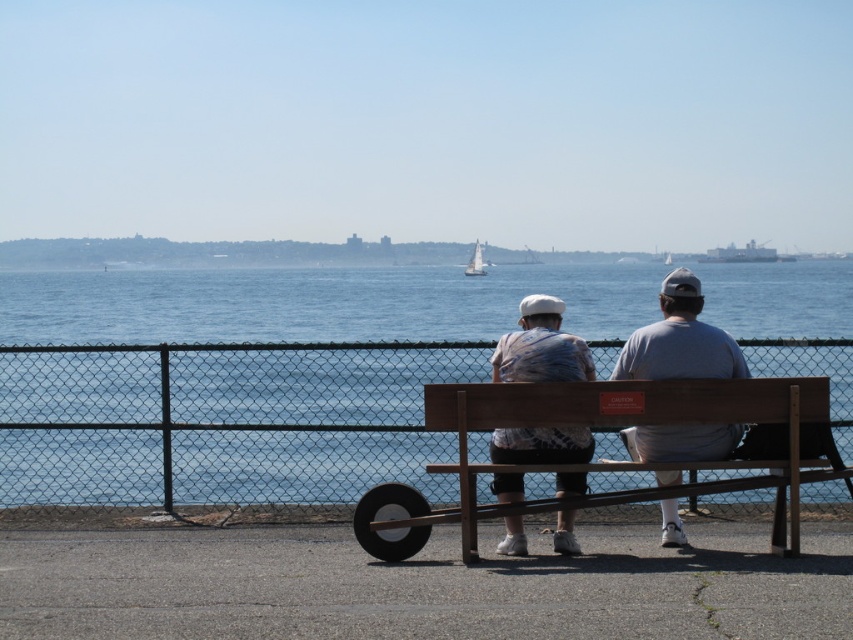
Question: Which object is farther from the camera taking this photo?

Choices:
 (A) white sailboat at center
 (B) metallic gray ship at upper right
 (C) wooden bench at center
 (D) white matte shirt at center

Answer: (B)

Question: Which object is farther from the camera taking this photo?

Choices:
 (A) wooden bench at center
 (B) metal chain-link fence at center
 (C) metallic gray ship at upper right

Answer: (C)

Question: Can you confirm if white cotton shirt at center is positioned to the right of white matte shirt at center?

Choices:
 (A) no
 (B) yes

Answer: (B)

Question: Can you confirm if wooden bench at center is positioned below white sailboat at center?

Choices:
 (A) yes
 (B) no

Answer: (A)

Question: Which object is positioned farthest from the white sailboat at center?

Choices:
 (A) white cotton shirt at center
 (B) metallic gray ship at upper right
 (C) wooden bench at center
 (D) white matte shirt at center

Answer: (A)

Question: Can you confirm if white cotton shirt at center is positioned to the right of white sailboat at center?

Choices:
 (A) no
 (B) yes

Answer: (B)